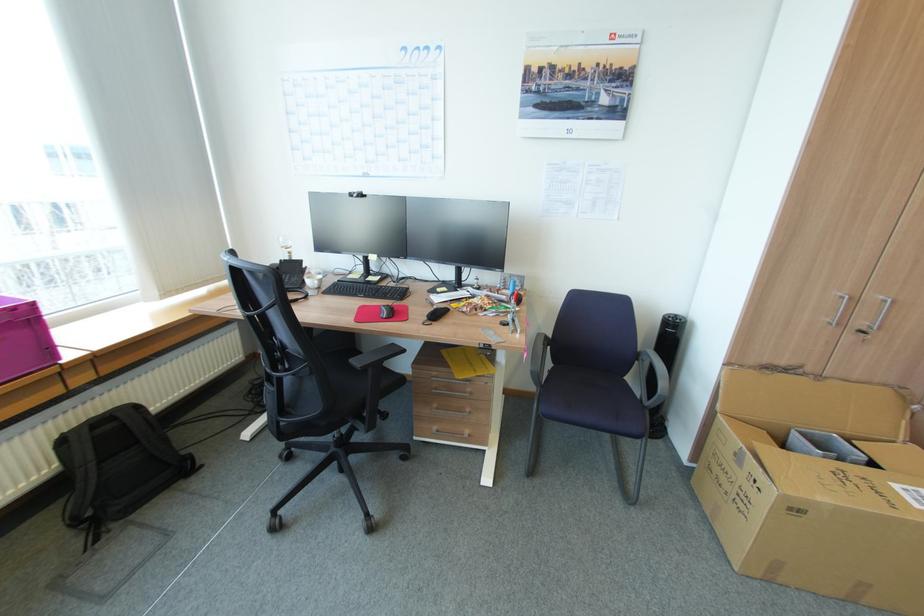
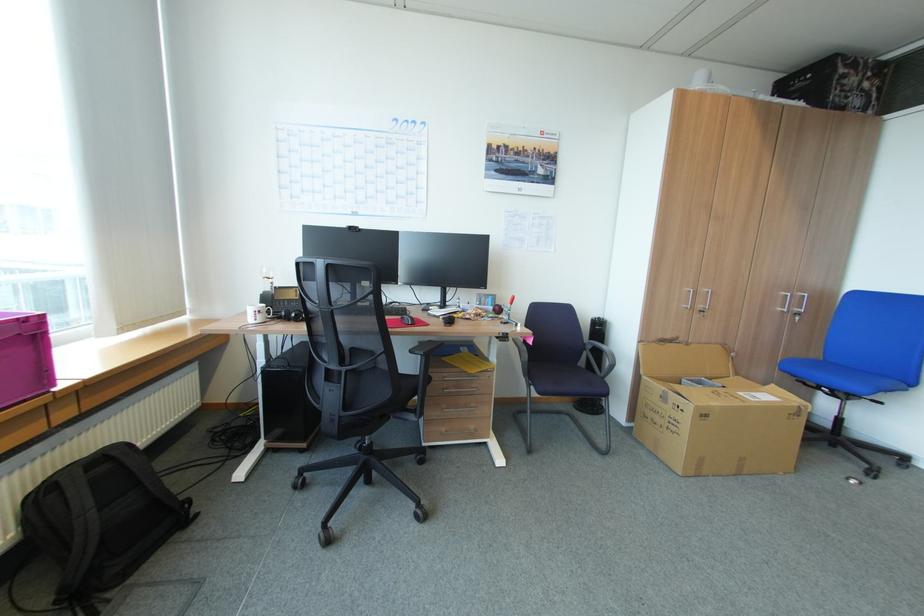
Question: How did the camera likely rotate?

Choices:
 (A) Left
 (B) Right
 (C) Up
 (D) Down

Answer: (B)